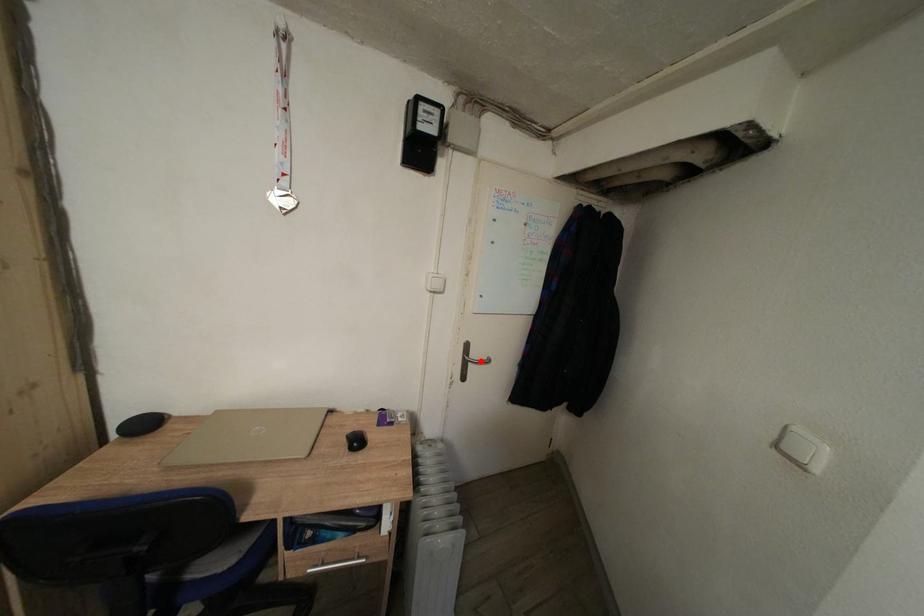
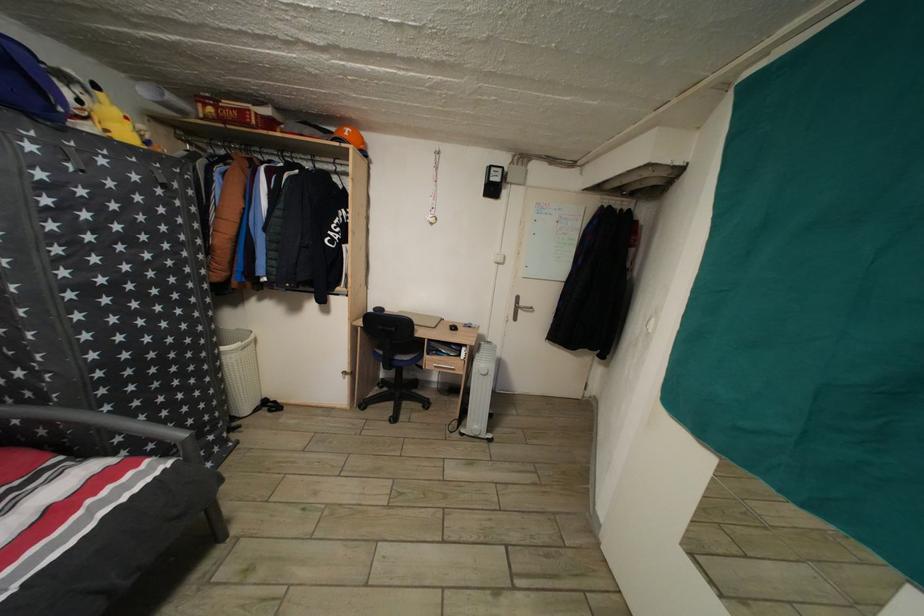
Question: A red point is marked in image1. In image2, is the corresponding 3D point closer to the camera or farther? Reply with the corresponding letter.

Choices:
 (A) The corresponding 3D point is closer.
 (B) The corresponding 3D point is farther.

Answer: (A)